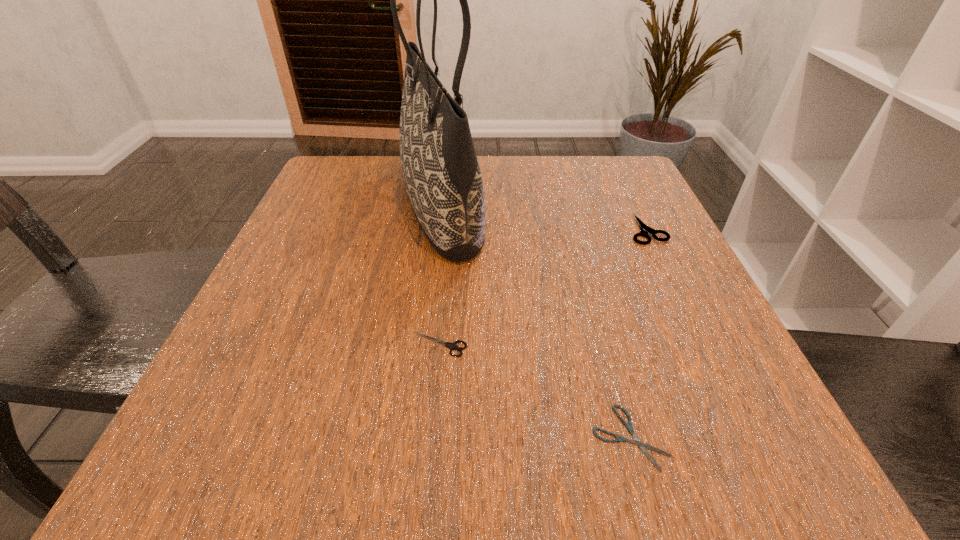
Locate an element on the screen. The height and width of the screenshot is (540, 960). vacant region at the far right corner is located at coordinates (590, 187).

Find the location of `vacant space at the near right corner of the desktop`. vacant space at the near right corner of the desktop is located at coordinates (770, 443).

The height and width of the screenshot is (540, 960). What are the coordinates of `free space between the tote bag and the tallest shears` in the screenshot? It's located at (543, 218).

Identify the location of free spot between the tallest object and the nearest object. The width and height of the screenshot is (960, 540). (536, 322).

Locate an element on the screen. The width and height of the screenshot is (960, 540). vacant point located between the second shortest shears and the tote bag is located at coordinates tap(441, 276).

In order to click on vacant area between the second farthest shears and the rightmost object in this screenshot , I will do (543, 287).

Where is `vacant point located between the second tallest object and the shortest shears`? vacant point located between the second tallest object and the shortest shears is located at coordinates (638, 333).

The height and width of the screenshot is (540, 960). Find the location of `free spot between the nearest object and the second shortest shears`. free spot between the nearest object and the second shortest shears is located at coordinates (535, 391).

Identify the location of vacant area that lies between the second shortest object and the shortest object. (535, 391).

Locate an element on the screen. free point between the leftmost shears and the tote bag is located at coordinates (441, 276).